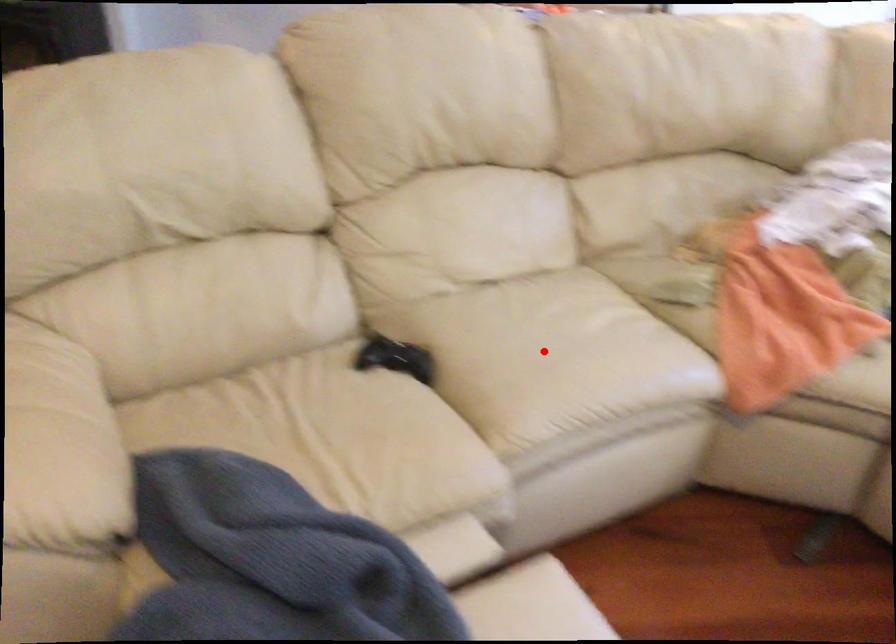
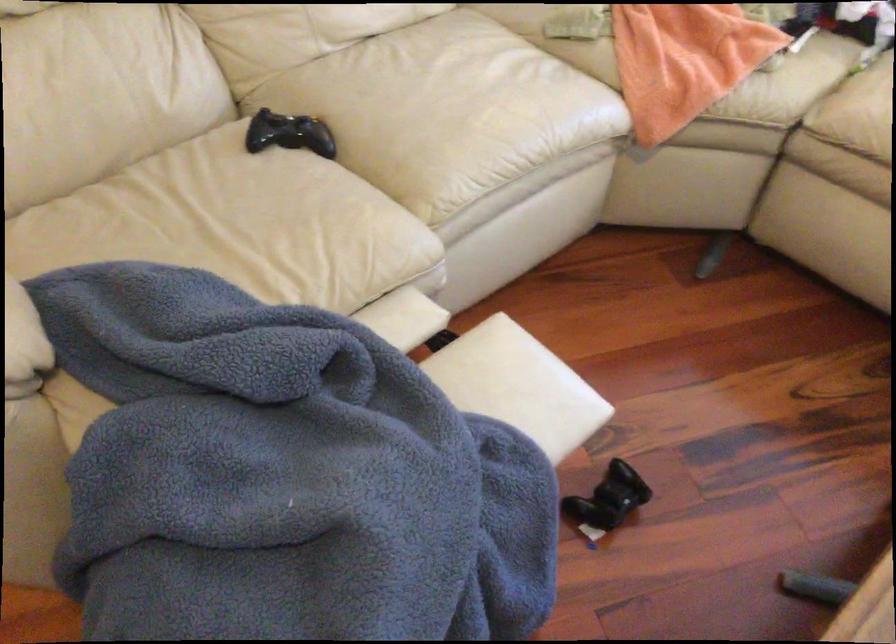
Find the pixel in the second image that matches the highlighted location in the first image.

(446, 109)